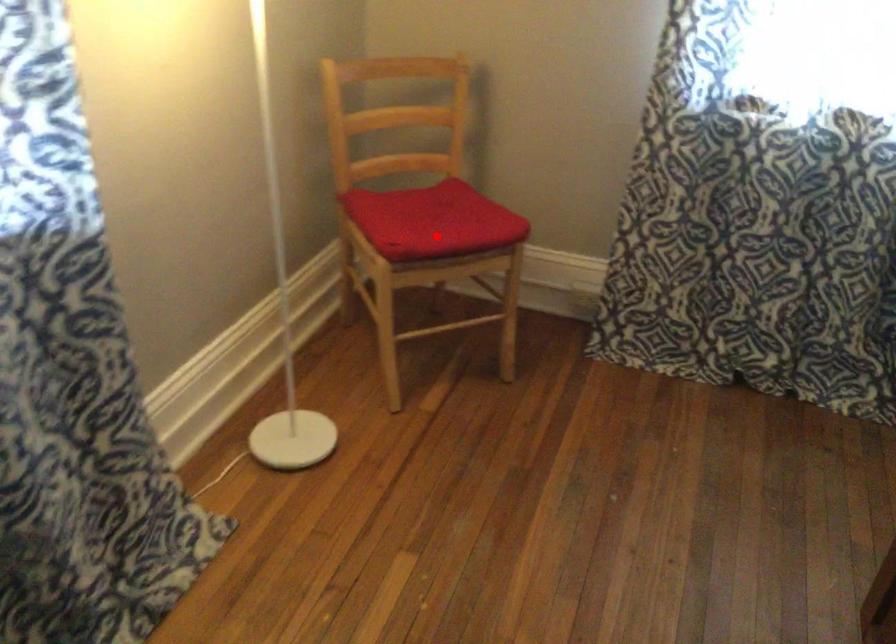
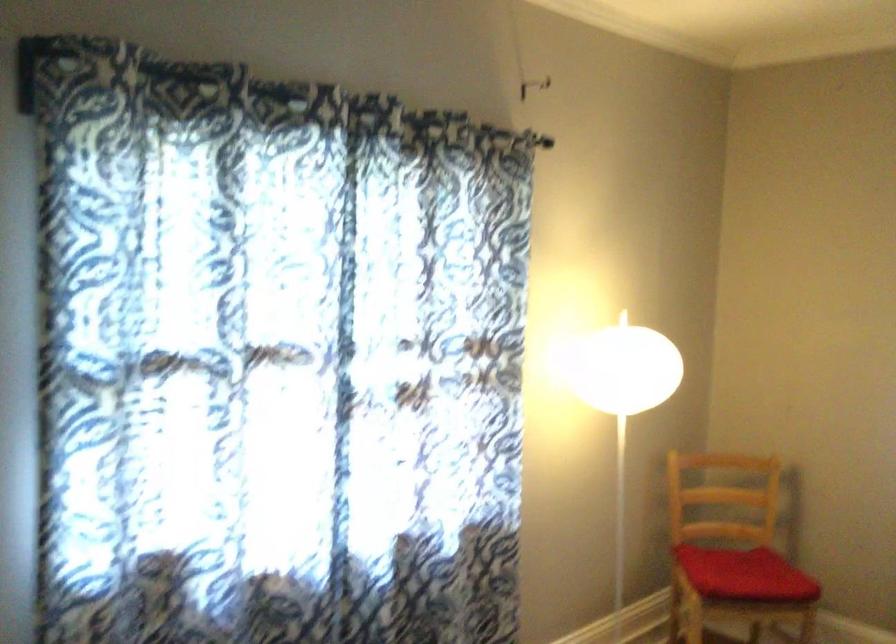
Question: I am providing you with two images of the same scene from different viewpoints. Given a red point in image1, look at the same physical point in image2. Is it:

Choices:
 (A) Closer to the viewpoint
 (B) Farther from the viewpoint

Answer: (B)